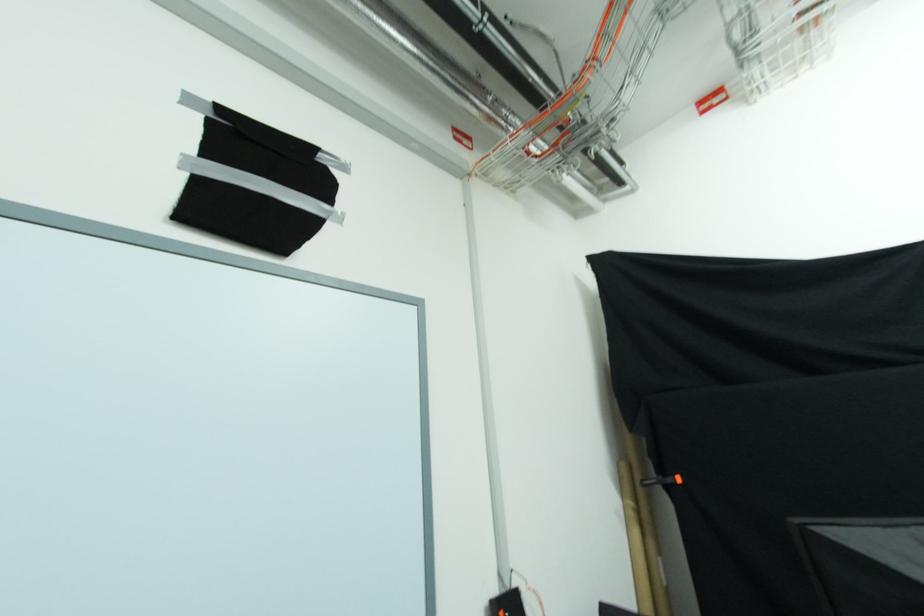
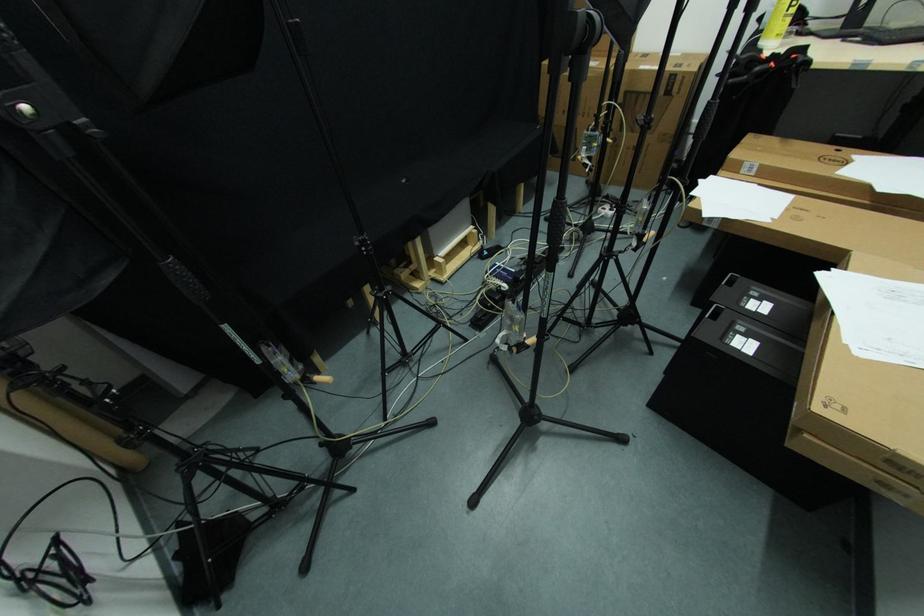
The images are taken continuously from a first-person perspective. In which direction is your viewpoint rotating?

The camera's rotation is toward right-down.